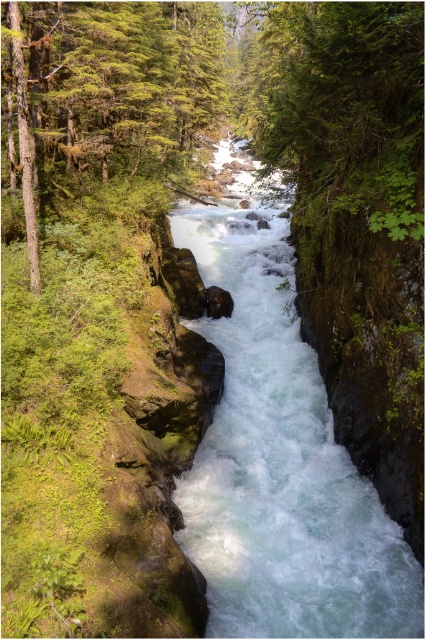
Question: Can you confirm if clear water at center is bigger than green mossy tree at upper left?

Choices:
 (A) yes
 (B) no

Answer: (A)

Question: Which point is closer to the camera?

Choices:
 (A) (281, 282)
 (B) (109, 161)

Answer: (B)

Question: Does clear water at center appear on the left side of green mossy tree at upper left?

Choices:
 (A) no
 (B) yes

Answer: (A)

Question: Is clear water at center thinner than green mossy tree at upper left?

Choices:
 (A) yes
 (B) no

Answer: (B)

Question: Which object appears closest to the camera in this image?

Choices:
 (A) clear water at center
 (B) green mossy tree at upper left

Answer: (B)

Question: Which object is closer to the camera taking this photo?

Choices:
 (A) clear water at center
 (B) green mossy tree at upper left

Answer: (B)